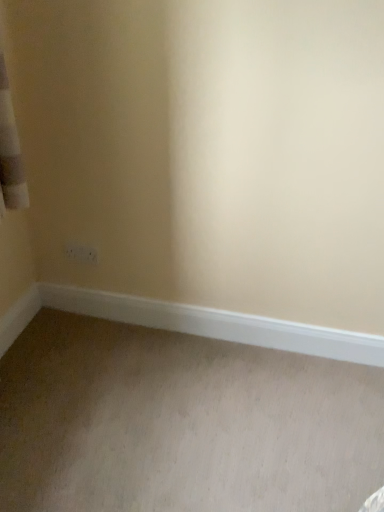
Question: Considering the positions of white smooth baseboard at lower center and beige carpet at lower left in the image, is white smooth baseboard at lower center taller or shorter than beige carpet at lower left?

Choices:
 (A) tall
 (B) short

Answer: (A)

Question: Is point (168, 326) closer or farther from the camera than point (145, 394)?

Choices:
 (A) farther
 (B) closer

Answer: (A)

Question: Would you say white smooth baseboard at lower center is inside or outside beige carpet at lower left?

Choices:
 (A) outside
 (B) inside

Answer: (A)

Question: Considering their positions, is beige carpet at lower left located in front of or behind white smooth baseboard at lower center?

Choices:
 (A) behind
 (B) front

Answer: (B)

Question: Do you think beige carpet at lower left is within white smooth baseboard at lower center, or outside of it?

Choices:
 (A) outside
 (B) inside

Answer: (A)

Question: Would you say beige carpet at lower left is to the left or to the right of white smooth baseboard at lower center in the picture?

Choices:
 (A) left
 (B) right

Answer: (A)

Question: Is beige carpet at lower left wider or thinner than white smooth baseboard at lower center?

Choices:
 (A) thin
 (B) wide

Answer: (B)